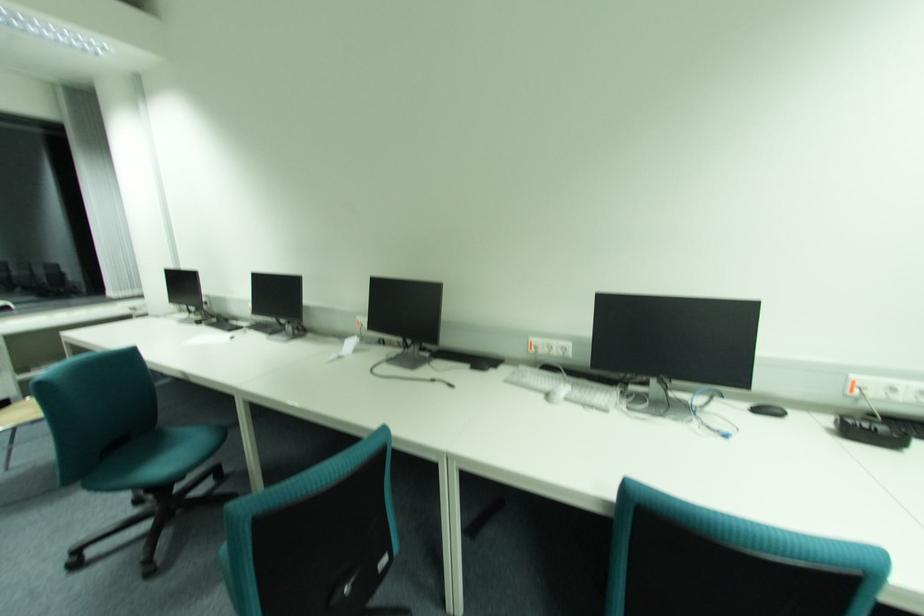
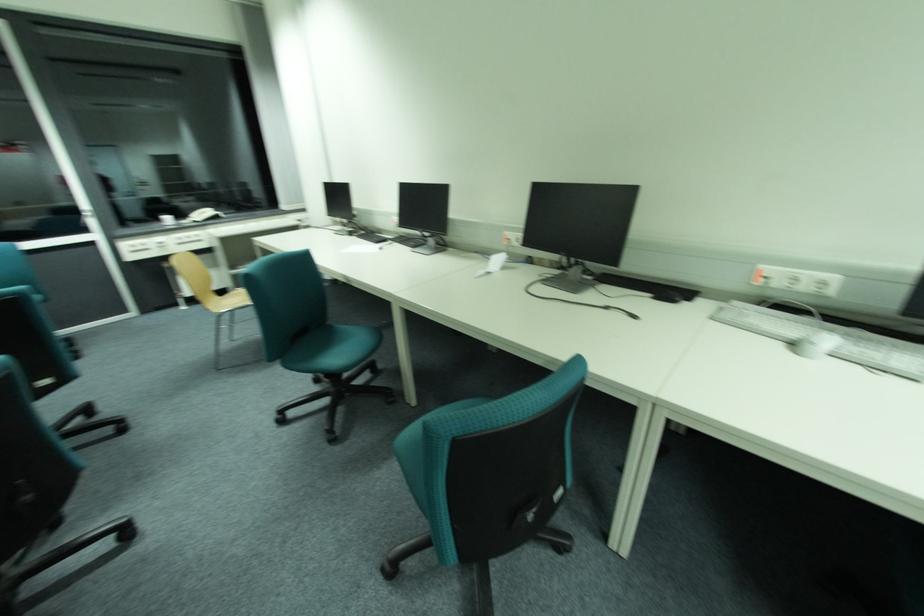
In the second image, find the point that corresponds to point 542,352 in the first image.

(772, 283)